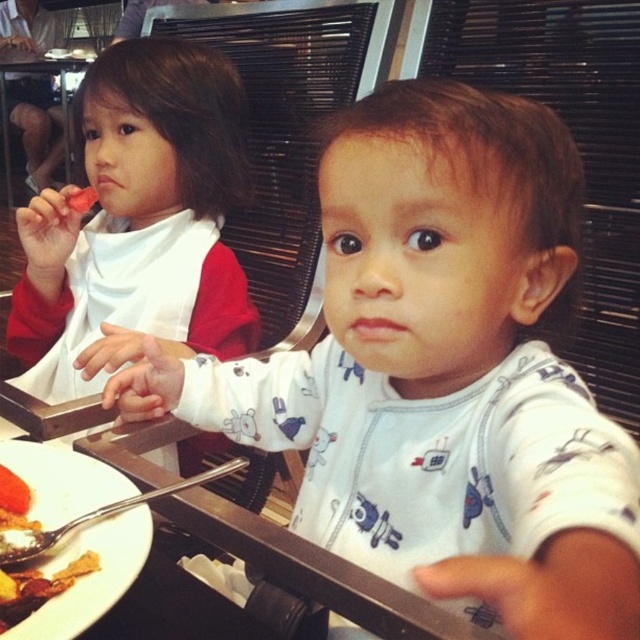
You are a restaurant worker who needs to place a new menu on the table. The menu is 12 inches wide. You see the white matte bib at upper left and the soft yellow bread at lower left. Which object can the menu fit next to without overlapping?

The menu can fit next to the white matte bib at upper left since it is wider than the soft yellow bread at lower left, providing enough space.

Consider the image. You are a parent trying to place a small toy between the white matte bib at upper left and the soft yellow bread at lower left. The toy requires 20 inches of space. Can you fit it there?

The distance between the white matte bib at upper left and the soft yellow bread at lower left is 25.43 inches, which is more than enough to fit the 20 inches required for the toy.